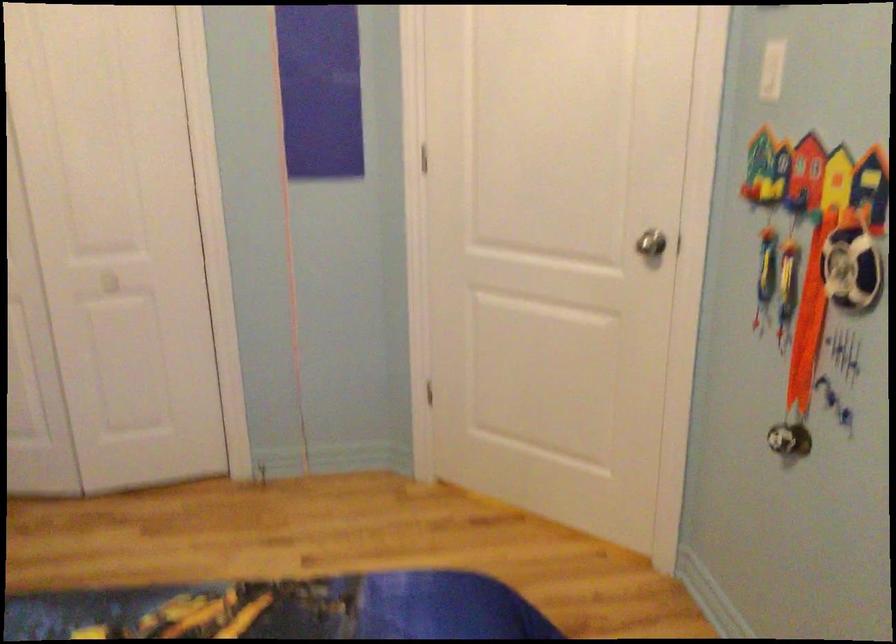
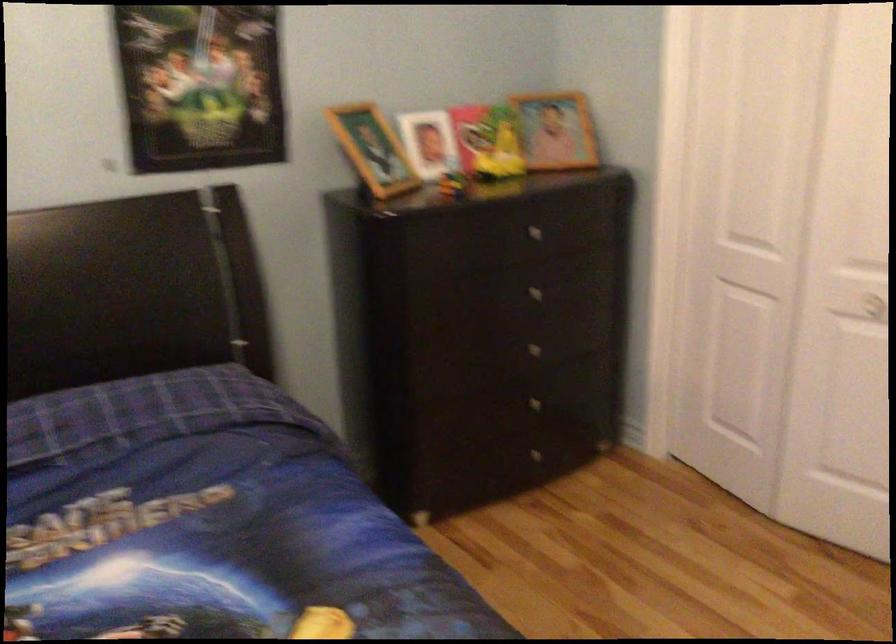
Question: How did the camera likely rotate?

Choices:
 (A) Left
 (B) Right
 (C) Up
 (D) Down

Answer: (A)